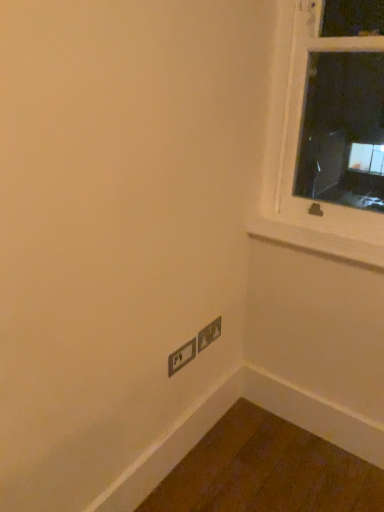
The width and height of the screenshot is (384, 512). Describe the element at coordinates (316, 240) in the screenshot. I see `wooden at upper right` at that location.

Where is `matte gray power plugs and sockets at lower right, which ranks as the second power plugs and sockets in left-to-right order`? matte gray power plugs and sockets at lower right, which ranks as the second power plugs and sockets in left-to-right order is located at coordinates pos(209,334).

Is wooden at upper right further to the viewer compared to matte black power plugs and sockets at lower center, the 1th power plugs and sockets viewed from the left?

No, wooden at upper right is in front of matte black power plugs and sockets at lower center, the 1th power plugs and sockets viewed from the left.

Could you tell me if wooden at upper right is turned towards matte black power plugs and sockets at lower center, which is counted as the second power plugs and sockets, starting from the right?

No.

Which object is positioned more to the left, wooden at upper right or matte black power plugs and sockets at lower center, which is counted as the second power plugs and sockets, starting from the right?

From the viewer's perspective, matte black power plugs and sockets at lower center, which is counted as the second power plugs and sockets, starting from the right, appears more on the left side.

Locate an element on the screen. Image resolution: width=384 pixels, height=512 pixels. window sill on the right of matte black power plugs and sockets at lower center, the 1th power plugs and sockets viewed from the left is located at coordinates (316, 240).

Is matte black power plugs and sockets at lower center, the 1th power plugs and sockets viewed from the left, touching wooden at upper right?

No, matte black power plugs and sockets at lower center, the 1th power plugs and sockets viewed from the left, is not touching wooden at upper right.

Measure the distance from matte black power plugs and sockets at lower center, which is counted as the second power plugs and sockets, starting from the right, to wooden at upper right.

A distance of 21.58 inches exists between matte black power plugs and sockets at lower center, which is counted as the second power plugs and sockets, starting from the right, and wooden at upper right.

Between matte black power plugs and sockets at lower center, which is counted as the second power plugs and sockets, starting from the right, and wooden at upper right, which one is positioned in front?

wooden at upper right is closer to the camera.

Does wooden at upper right appear on the left side of matte gray power plugs and sockets at lower right, which ranks as the second power plugs and sockets in left-to-right order?

Incorrect, wooden at upper right is not on the left side of matte gray power plugs and sockets at lower right, which ranks as the second power plugs and sockets in left-to-right order.

Which is in front, wooden at upper right or matte gray power plugs and sockets at lower right, which is the first power plugs and sockets in right-to-left order?

wooden at upper right.

Find the location of a particular element. window sill that is in front of the matte gray power plugs and sockets at lower right, which is the first power plugs and sockets in right-to-left order is located at coordinates (316, 240).

Is wooden at upper right oriented towards matte gray power plugs and sockets at lower right, which ranks as the second power plugs and sockets in left-to-right order?

No, wooden at upper right does not turn towards matte gray power plugs and sockets at lower right, which ranks as the second power plugs and sockets in left-to-right order.

Is matte black power plugs and sockets at lower center, the 1th power plugs and sockets viewed from the left, smaller than matte gray power plugs and sockets at lower right, which is the first power plugs and sockets in right-to-left order?

Actually, matte black power plugs and sockets at lower center, the 1th power plugs and sockets viewed from the left, might be larger than matte gray power plugs and sockets at lower right, which is the first power plugs and sockets in right-to-left order.

Which object is further away from the camera taking this photo, matte black power plugs and sockets at lower center, the 1th power plugs and sockets viewed from the left, or matte gray power plugs and sockets at lower right, which is the first power plugs and sockets in right-to-left order?

matte gray power plugs and sockets at lower right, which is the first power plugs and sockets in right-to-left order, is further away from the camera.

From the image's perspective, is matte black power plugs and sockets at lower center, the 1th power plugs and sockets viewed from the left, on matte gray power plugs and sockets at lower right, which ranks as the second power plugs and sockets in left-to-right order?

Incorrect, from the image's perspective, matte black power plugs and sockets at lower center, the 1th power plugs and sockets viewed from the left, is lower than matte gray power plugs and sockets at lower right, which ranks as the second power plugs and sockets in left-to-right order.

From the image's perspective, is matte gray power plugs and sockets at lower right, which ranks as the second power plugs and sockets in left-to-right order, positioned above or below wooden at upper right?

matte gray power plugs and sockets at lower right, which ranks as the second power plugs and sockets in left-to-right order, is below wooden at upper right.

Is point (217, 333) less distant than point (306, 245)?

No, it is behind (306, 245).

Consider the image. Does matte gray power plugs and sockets at lower right, which ranks as the second power plugs and sockets in left-to-right order, come in front of wooden at upper right?

No, matte gray power plugs and sockets at lower right, which ranks as the second power plugs and sockets in left-to-right order, is further to the viewer.

Which of these two, matte gray power plugs and sockets at lower right, which ranks as the second power plugs and sockets in left-to-right order, or wooden at upper right, is bigger?

With larger size is wooden at upper right.

Locate an element on the screen. power plugs and sockets that is above the matte black power plugs and sockets at lower center, the 1th power plugs and sockets viewed from the left (from a real-world perspective) is located at coordinates (209, 334).

Can you confirm if matte gray power plugs and sockets at lower right, which is the first power plugs and sockets in right-to-left order, is thinner than matte black power plugs and sockets at lower center, which is counted as the second power plugs and sockets, starting from the right?

Yes.

Which of these two, matte gray power plugs and sockets at lower right, which is the first power plugs and sockets in right-to-left order, or matte black power plugs and sockets at lower center, which is counted as the second power plugs and sockets, starting from the right, stands shorter?

Standing shorter between the two is matte black power plugs and sockets at lower center, which is counted as the second power plugs and sockets, starting from the right.

Considering the relative sizes of matte gray power plugs and sockets at lower right, which is the first power plugs and sockets in right-to-left order, and matte black power plugs and sockets at lower center, the 1th power plugs and sockets viewed from the left, in the image provided, is matte gray power plugs and sockets at lower right, which is the first power plugs and sockets in right-to-left order, smaller than matte black power plugs and sockets at lower center, the 1th power plugs and sockets viewed from the left,?

Correct, matte gray power plugs and sockets at lower right, which is the first power plugs and sockets in right-to-left order, occupies less space than matte black power plugs and sockets at lower center, the 1th power plugs and sockets viewed from the left.

There is a matte black power plugs and sockets at lower center, the 1th power plugs and sockets viewed from the left. Where is `window sill above it (from a real-world perspective)`? Image resolution: width=384 pixels, height=512 pixels. window sill above it (from a real-world perspective) is located at coordinates tap(316, 240).

Where is `the 1st power plugs and sockets behind the wooden at upper right, starting your count from the anchor`? the 1st power plugs and sockets behind the wooden at upper right, starting your count from the anchor is located at coordinates (181, 357).

Which object lies further to the anchor point wooden at upper right, matte gray power plugs and sockets at lower right, which is the first power plugs and sockets in right-to-left order, or matte black power plugs and sockets at lower center, which is counted as the second power plugs and sockets, starting from the right?

Among the two, matte black power plugs and sockets at lower center, which is counted as the second power plugs and sockets, starting from the right, is located further to wooden at upper right.

Based on their spatial positions, is wooden at upper right or matte black power plugs and sockets at lower center, which is counted as the second power plugs and sockets, starting from the right, further from matte gray power plugs and sockets at lower right, which is the first power plugs and sockets in right-to-left order?

wooden at upper right is positioned further to the anchor matte gray power plugs and sockets at lower right, which is the first power plugs and sockets in right-to-left order.

Looking at the image, which one is located further to wooden at upper right, matte black power plugs and sockets at lower center, which is counted as the second power plugs and sockets, starting from the right, or matte gray power plugs and sockets at lower right, which ranks as the second power plugs and sockets in left-to-right order?

Based on the image, matte black power plugs and sockets at lower center, which is counted as the second power plugs and sockets, starting from the right, appears to be further to wooden at upper right.

Estimate the real-world distances between objects in this image. Which object is closer to matte black power plugs and sockets at lower center, the 1th power plugs and sockets viewed from the left, matte gray power plugs and sockets at lower right, which is the first power plugs and sockets in right-to-left order, or wooden at upper right?

matte gray power plugs and sockets at lower right, which is the first power plugs and sockets in right-to-left order, lies closer to matte black power plugs and sockets at lower center, the 1th power plugs and sockets viewed from the left, than the other object.

Considering their positions, is matte black power plugs and sockets at lower center, which is counted as the second power plugs and sockets, starting from the right, positioned further to matte gray power plugs and sockets at lower right, which is the first power plugs and sockets in right-to-left order, than wooden at upper right?

wooden at upper right is further to matte gray power plugs and sockets at lower right, which is the first power plugs and sockets in right-to-left order.

Looking at the image, which one is located further to matte black power plugs and sockets at lower center, which is counted as the second power plugs and sockets, starting from the right, wooden at upper right or matte gray power plugs and sockets at lower right, which is the first power plugs and sockets in right-to-left order?

wooden at upper right is further to matte black power plugs and sockets at lower center, which is counted as the second power plugs and sockets, starting from the right.

Where is `power plugs and sockets located between matte black power plugs and sockets at lower center, the 1th power plugs and sockets viewed from the left, and wooden at upper right in the left-right direction`? The width and height of the screenshot is (384, 512). power plugs and sockets located between matte black power plugs and sockets at lower center, the 1th power plugs and sockets viewed from the left, and wooden at upper right in the left-right direction is located at coordinates (209, 334).